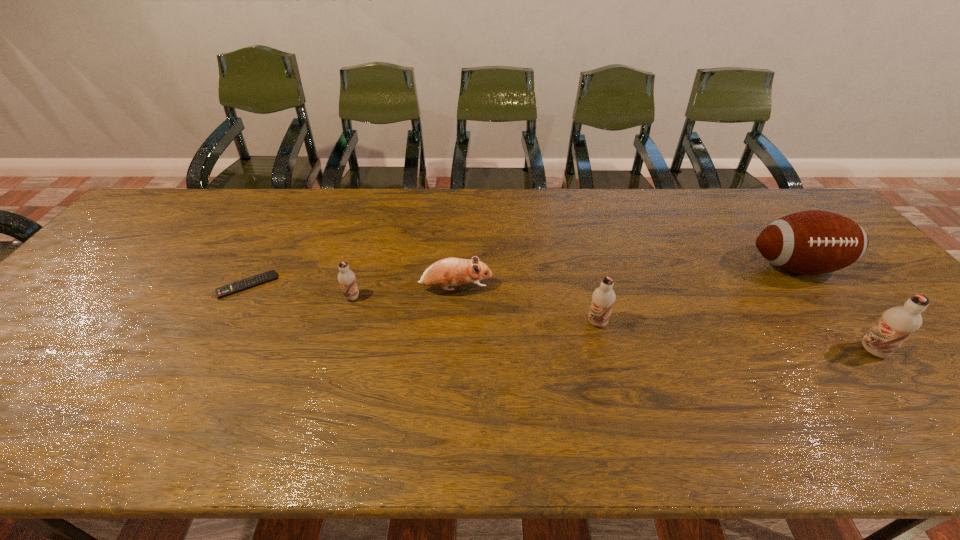
Locate an element on the screen. football is located at coordinates (813, 242).

Identify the location of vacant space positioned on the back of the third shortest object. (368, 245).

Identify the location of vacant area situated on the right of the third tallest object. (628, 322).

I want to click on free spot located on the back of the nearest object, so pos(790,248).

Find the location of a particular element. free space located 0.270m at the face of the second shortest object is located at coordinates (592, 289).

Where is `vacant space situated on the back of the shortest object`? This screenshot has height=540, width=960. vacant space situated on the back of the shortest object is located at coordinates (276, 235).

Image resolution: width=960 pixels, height=540 pixels. Identify the location of vacant space located on the laces of the football. (857, 345).

Where is `chocolate milk located in the right edge section of the desktop`? This screenshot has width=960, height=540. chocolate milk located in the right edge section of the desktop is located at coordinates (896, 324).

The image size is (960, 540). I want to click on football that is at the right edge, so click(x=813, y=242).

Where is `free space at the far edge`? The height and width of the screenshot is (540, 960). free space at the far edge is located at coordinates (650, 189).